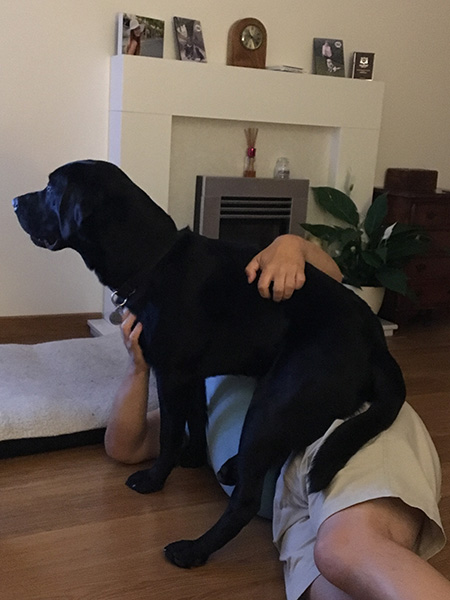
This screenshot has height=600, width=450. Find the location of `mantle`. mantle is located at coordinates (244, 87).